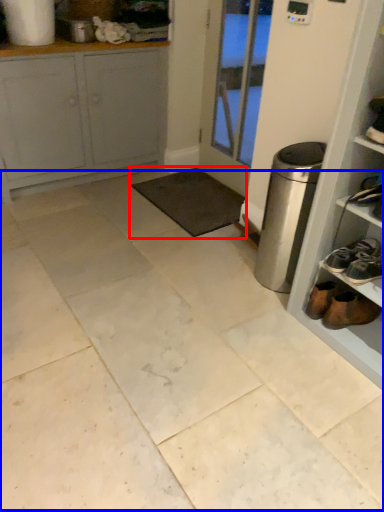
Question: Among these objects, which one is farthest to the camera, mat (highlighted by a red box) or ceramic tile (highlighted by a blue box)?

Choices:
 (A) mat
 (B) ceramic tile

Answer: (A)